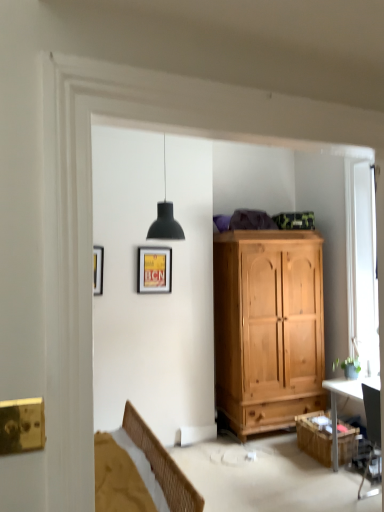
The image size is (384, 512). What do you see at coordinates (314, 438) in the screenshot? I see `wooden cabinet at lower right` at bounding box center [314, 438].

This screenshot has height=512, width=384. In order to click on black glossy desk at right in this screenshot , I will do `click(346, 396)`.

Identify the location of white wooden window at right. The width and height of the screenshot is (384, 512). (363, 264).

Identify the location of wooden cabinet at lower right. The image size is (384, 512). (314, 438).

From the image's perspective, which object appears higher, matte yellow poster at upper center or wooden cabinet at lower right?

From the image's view, matte yellow poster at upper center is above.

Does matte yellow poster at upper center have a larger size compared to wooden cabinet at lower right?

No, matte yellow poster at upper center is not bigger than wooden cabinet at lower right.

Is matte yellow poster at upper center far away from wooden cabinet at lower right?

Indeed, matte yellow poster at upper center is not near wooden cabinet at lower right.

Is matte yellow poster at upper center turned away from wooden cabinet at lower right?

That's not correct — matte yellow poster at upper center is not looking away from wooden cabinet at lower right.

In the scene shown: Is wooden cabinet at lower right closer to camera compared to white wooden window at right?

Yes, it is in front of white wooden window at right.

Is wooden cabinet at lower right surrounding white wooden window at right?

No, white wooden window at right is not inside wooden cabinet at lower right.

Is wooden cabinet at lower right smaller than white wooden window at right?

Yes, wooden cabinet at lower right is smaller than white wooden window at right.

Considering the relative sizes of matte yellow poster at upper center and black glossy desk at right in the image provided, is matte yellow poster at upper center smaller than black glossy desk at right?

Yes, matte yellow poster at upper center is smaller than black glossy desk at right.

Is matte yellow poster at upper center with black glossy desk at right?

No.

Between matte yellow poster at upper center and black glossy desk at right, which one appears on the left side from the viewer's perspective?

matte yellow poster at upper center.

Which is in front, point (341, 392) or point (152, 270)?

The point (341, 392) is closer.

Does black glossy desk at right lie behind matte yellow poster at upper center?

No, black glossy desk at right is in front of matte yellow poster at upper center.

Considering the relative sizes of black glossy desk at right and matte yellow poster at upper center in the image provided, is black glossy desk at right bigger than matte yellow poster at upper center?

Correct, black glossy desk at right is larger in size than matte yellow poster at upper center.

Where is `picture frame behind the white wooden window at right`? This screenshot has width=384, height=512. picture frame behind the white wooden window at right is located at coordinates (154, 270).

Between matte yellow poster at upper center and white wooden window at right, which one has more height?

With more height is white wooden window at right.

Is matte yellow poster at upper center next to white wooden window at right?

They are not placed beside each other.

In terms of size, does matte yellow poster at upper center appear bigger or smaller than white wooden window at right?

Considering their sizes, matte yellow poster at upper center takes up less space than white wooden window at right.

Is black glossy desk at right far from white wooden window at right?

No.

From a real-world perspective, is black glossy desk at right located beneath white wooden window at right?

Yes, from a real-world perspective, black glossy desk at right is below white wooden window at right.

Which is behind, point (332, 453) or point (351, 169)?

The point (351, 169) is farther from the camera.

Considering the relative sizes of wooden cabinet at lower right and matte yellow poster at upper center in the image provided, is wooden cabinet at lower right wider than matte yellow poster at upper center?

Correct, the width of wooden cabinet at lower right exceeds that of matte yellow poster at upper center.

Could matte yellow poster at upper center be considered to be inside wooden cabinet at lower right?

No, matte yellow poster at upper center is located outside of wooden cabinet at lower right.

Which object is closer to the camera, wooden cabinet at lower right or matte yellow poster at upper center?

wooden cabinet at lower right is closer to the camera.

At what (x,y) coordinates should I click in order to perform the action: click on cabinetry located in front of the matte yellow poster at upper center. Please return your answer as a coordinate pair (x, y). The image size is (384, 512). Looking at the image, I should click on pos(314,438).

What are the coordinates of `cabinetry lying on the right of matte yellow poster at upper center` in the screenshot? It's located at (314, 438).

At what (x,y) coordinates should I click in order to perform the action: click on window located above the wooden cabinet at lower right (from the image's perspective). Please return your answer as a coordinate pair (x, y). Image resolution: width=384 pixels, height=512 pixels. Looking at the image, I should click on (363, 264).

Which object lies further to the anchor point wooden cabinet at lower right, white wooden window at right or matte yellow poster at upper center?

matte yellow poster at upper center.

Which object lies nearer to the anchor point white wooden window at right, matte yellow poster at upper center or black glossy desk at right?

Among the two, black glossy desk at right is located nearer to white wooden window at right.

From the image, which object appears to be farther from matte yellow poster at upper center, white wooden window at right or black glossy desk at right?

white wooden window at right is further to matte yellow poster at upper center.

From the image, which object appears to be farther from wooden cabinet at lower right, black glossy desk at right or white wooden window at right?

white wooden window at right.

When comparing their distances from white wooden window at right, does wooden cabinet at lower right or matte yellow poster at upper center seem closer?

Among the two, wooden cabinet at lower right is located nearer to white wooden window at right.

Looking at the image, which one is located closer to white wooden window at right, black glossy desk at right or matte yellow poster at upper center?

black glossy desk at right lies closer to white wooden window at right than the other object.

Based on their spatial positions, is wooden cabinet at lower right or black glossy desk at right closer to white wooden window at right?

The object closer to white wooden window at right is black glossy desk at right.

When comparing their distances from white wooden window at right, does matte yellow poster at upper center or wooden cabinet at lower right seem further?

matte yellow poster at upper center.

Identify the location of cabinetry between matte yellow poster at upper center and white wooden window at right in the horizontal direction. (314, 438).

Find the location of a particular element. The width and height of the screenshot is (384, 512). desk between white wooden window at right and wooden cabinet at lower right from top to bottom is located at coordinates (346, 396).

At what (x,y) coordinates should I click in order to perform the action: click on desk between matte yellow poster at upper center and white wooden window at right from left to right. Please return your answer as a coordinate pair (x, y). Looking at the image, I should click on (346, 396).

Where is `cabinetry between matte yellow poster at upper center and black glossy desk at right in the horizontal direction`? The width and height of the screenshot is (384, 512). cabinetry between matte yellow poster at upper center and black glossy desk at right in the horizontal direction is located at coordinates (314, 438).